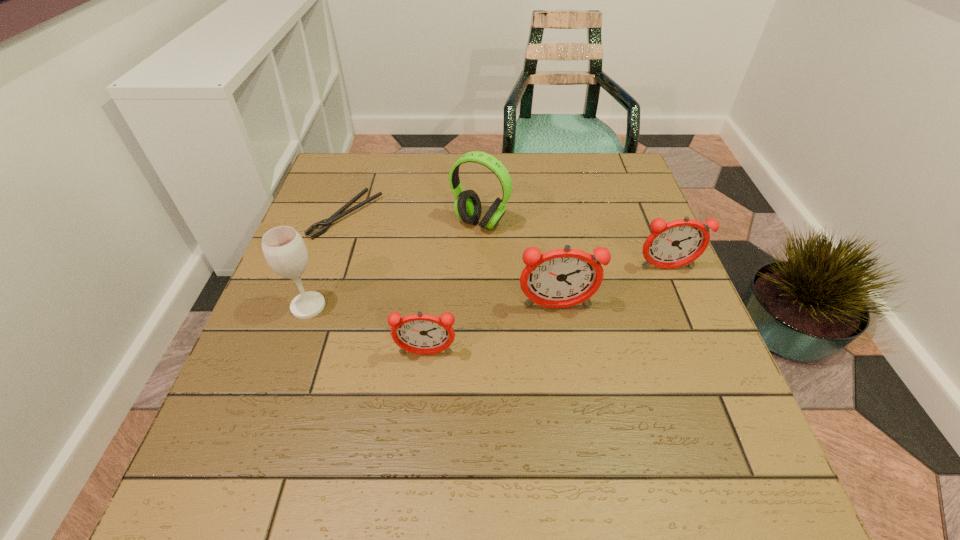
Identify the location of the second shortest object. The width and height of the screenshot is (960, 540). (424, 334).

Where is `the shortest alarm clock`? the shortest alarm clock is located at coordinates (424, 334).

The image size is (960, 540). I want to click on the second nearest alarm clock, so point(559,278).

I want to click on the second alarm clock from right to left, so click(x=559, y=278).

The width and height of the screenshot is (960, 540). What are the coordinates of `the farthest alarm clock` in the screenshot? It's located at (677, 243).

Identify the location of the fourth nearest object. This screenshot has width=960, height=540. (677, 243).

You are a GUI agent. You are given a task and a screenshot of the screen. Output one action in this format:
    pyautogui.click(x=<x>, y=<y>)
    Task: Click on the shortest object
    This screenshot has height=540, width=960.
    Given the screenshot: What is the action you would take?
    pyautogui.click(x=326, y=223)

Where is `wineglass`? The width and height of the screenshot is (960, 540). wineglass is located at coordinates (283, 247).

Identify the location of headset. This screenshot has height=540, width=960. (467, 205).

What are the coordinates of `vacant space positioned on the front-facing side of the nearest object` in the screenshot? It's located at (419, 423).